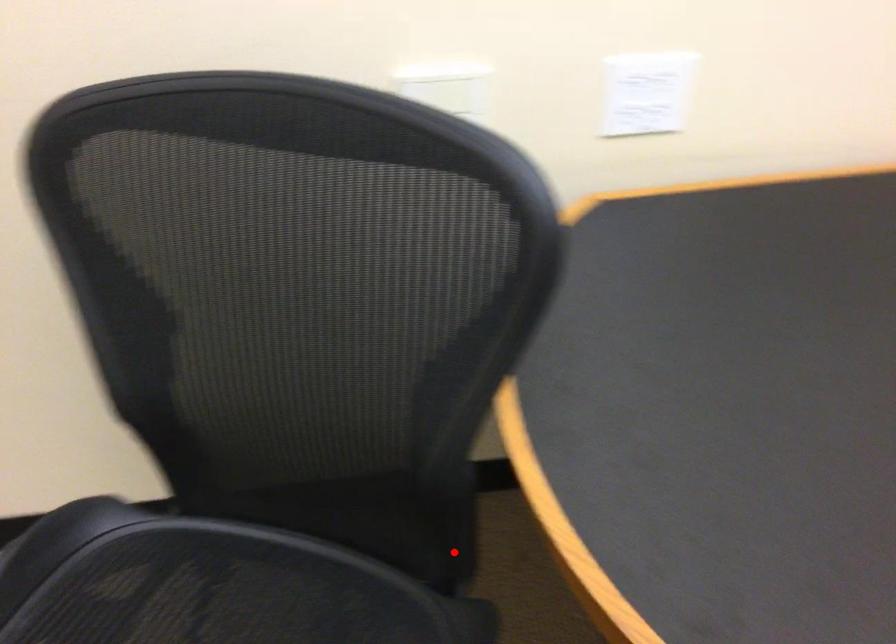
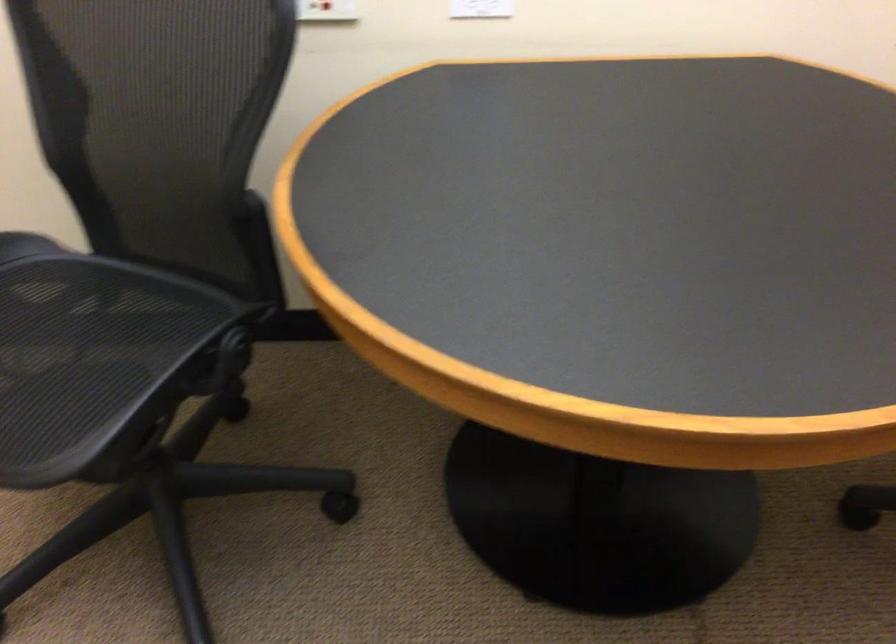
The point at the highlighted location is marked in the first image. Where is the corresponding point in the second image?

(264, 277)